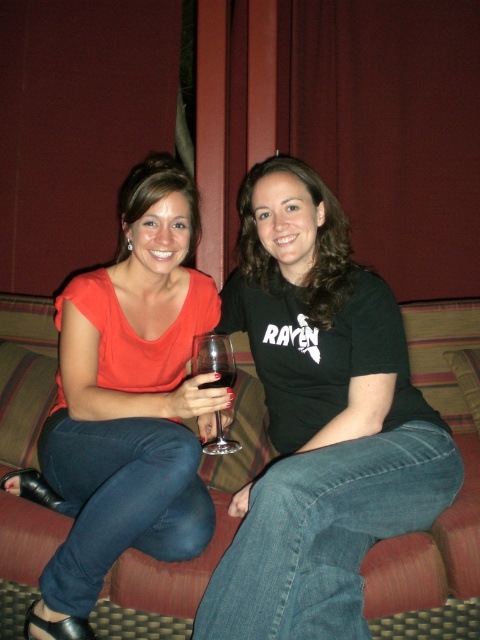
Is clear glass wine glass at center behind clear glass wine at center?

Yes, it is behind clear glass wine at center.

Is clear glass wine glass at center to the left of clear glass wine at center from the viewer's perspective?

Correct, you'll find clear glass wine glass at center to the left of clear glass wine at center.

Which is in front, point (239, 449) or point (208, 369)?

Point (208, 369) is in front.

Where is `clear glass wine glass at center`? clear glass wine glass at center is located at coordinates pos(214,358).

Does textured fabric couch at center have a greater height compared to clear glass wine glass at center?

Correct, textured fabric couch at center is much taller as clear glass wine glass at center.

Does point (163, 568) come behind point (229, 349)?

No, (163, 568) is closer to viewer.

In order to click on textured fabric couch at center in this screenshot , I will do `click(442, 515)`.

Which is above, matte orange blouse at center or clear glass wine at center?

clear glass wine at center is above.

Is matte orange blouse at center in front of clear glass wine at center?

Yes, it is in front of clear glass wine at center.

Is point (141, 243) farther from viewer compared to point (235, 369)?

Yes.

This screenshot has height=640, width=480. What are the coordinates of `matte orange blouse at center` in the screenshot? It's located at (127, 403).